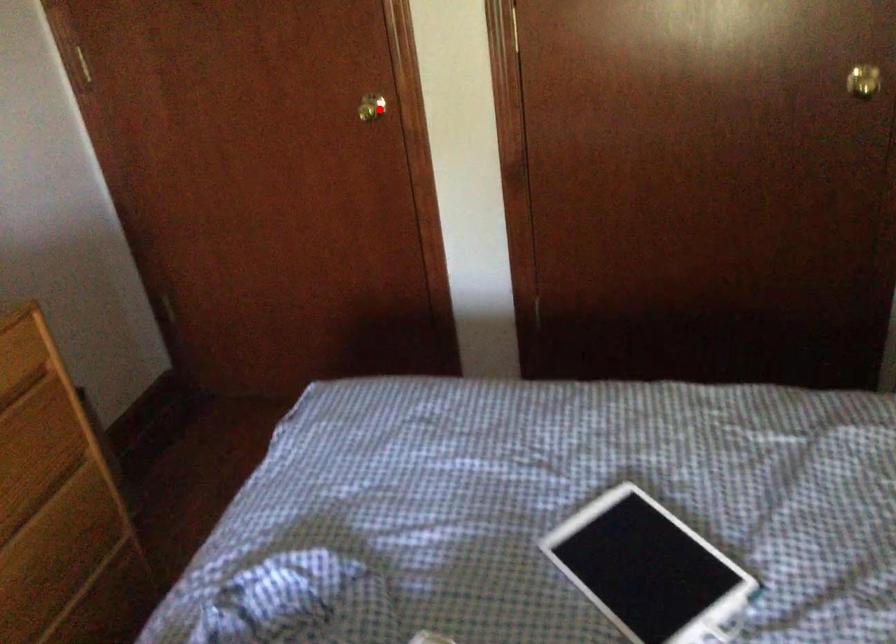
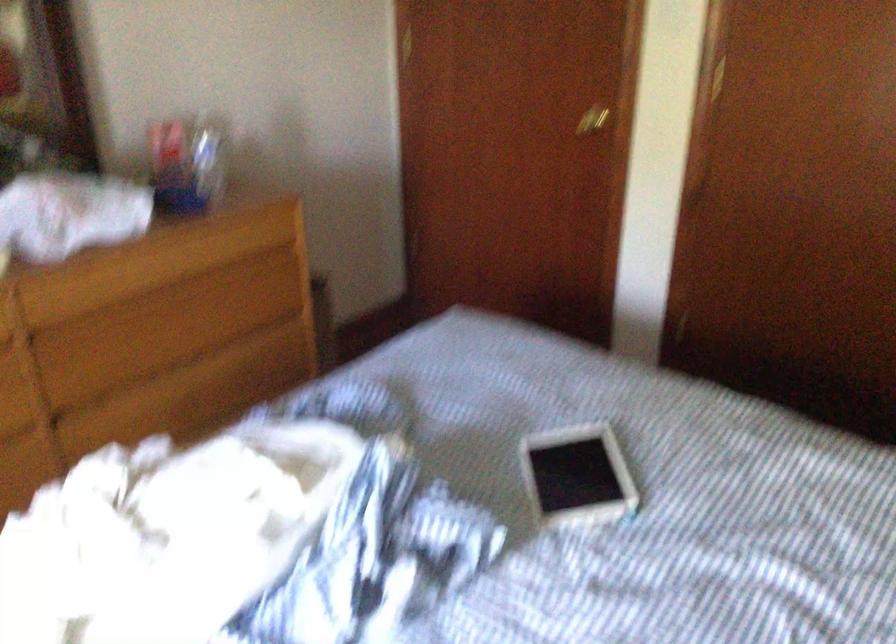
The point at the highlighted location is marked in the first image. Where is the corresponding point in the second image?

(592, 120)